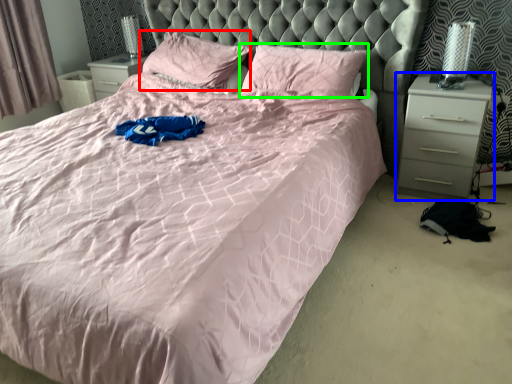
Question: Estimate the real-world distances between objects in this image. Which object is farther from pillow (highlighted by a red box), nightstand (highlighted by a blue box) or pillow (highlighted by a green box)?

Choices:
 (A) nightstand
 (B) pillow

Answer: (A)